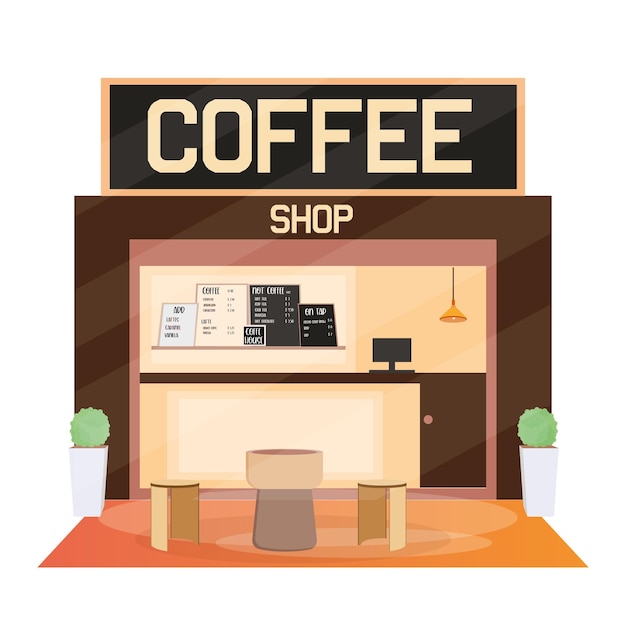
Find the location of a particular element. The height and width of the screenshot is (626, 626). computer is located at coordinates (387, 344).